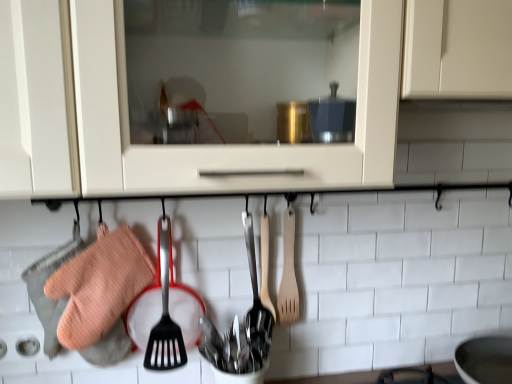
Question: In the image, is wooden spatula at center, the first spatula positioned from the left, on the left side or the right side of orange waffle oven mitt at left?

Choices:
 (A) left
 (B) right

Answer: (B)

Question: From a real-world perspective, is wooden spatula at center, which is the second spatula in right-to-left order, physically located above or below orange waffle oven mitt at left?

Choices:
 (A) above
 (B) below

Answer: (A)

Question: Considering the real-world distances, which object is farthest from the polished stainless steel cutlery at center, marked as the first silverware in a bottom-to-top arrangement?

Choices:
 (A) wooden spatula at center, which is the second spatula in right-to-left order
 (B) polished stainless steel spoons at center, acting as the second silverware starting from the bottom
 (C) wooden spatula at center-right, which ranks as the first spatula in right-to-left order
 (D) orange waffle oven mitt at left

Answer: (D)

Question: Which of these objects is positioned closest to the wooden spatula at center, the first spatula positioned from the left?

Choices:
 (A) wooden spatula at center-right, which ranks as the first spatula in right-to-left order
 (B) orange waffle oven mitt at left
 (C) polished stainless steel spoons at center, acting as the second silverware starting from the bottom
 (D) polished stainless steel cutlery at center, which is the second silverware in top-to-bottom order

Answer: (C)